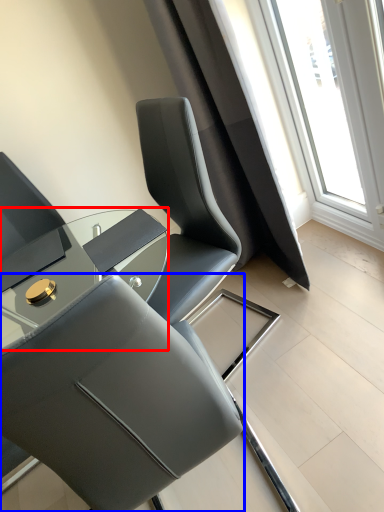
Question: Among these objects, which one is nearest to the camera, table (highlighted by a red box) or chair (highlighted by a blue box)?

Choices:
 (A) table
 (B) chair

Answer: (B)